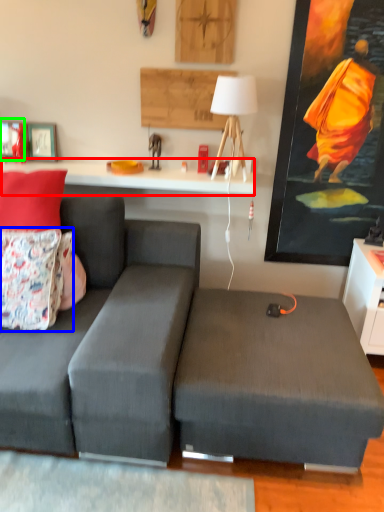
Question: Based on their relative distances, which object is nearer to table (highlighted by a red box)? Choose from pillow (highlighted by a blue box) and picture frame (highlighted by a green box).

Choices:
 (A) pillow
 (B) picture frame

Answer: (B)